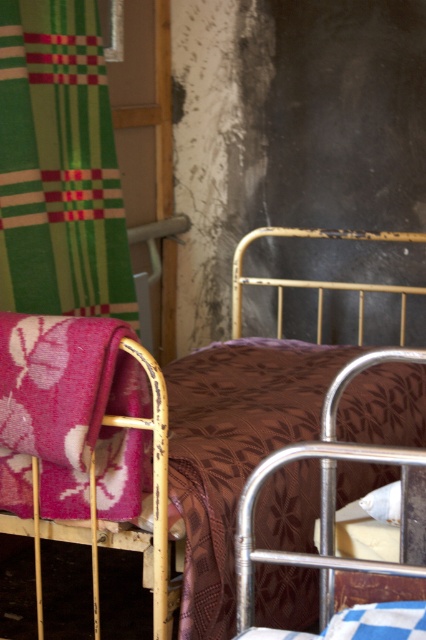
Does brown floral fabric at center lie behind brown floral fabric bed at center?

No.

Can you confirm if brown floral fabric at center is positioned below brown floral fabric bed at center?

Indeed, brown floral fabric at center is positioned under brown floral fabric bed at center.

What are the coordinates of `brown floral fabric at center` in the screenshot? It's located at (233, 451).

Is point (13, 58) less distant than point (146, 474)?

No, (13, 58) is behind (146, 474).

Does green striped fabric at upper left lie in front of floral pink fabric at left?

No.

Locate an element on the screen. green striped fabric at upper left is located at coordinates (58, 166).

Which is more to the right, brown floral fabric at center or green striped fabric at upper left?

From the viewer's perspective, brown floral fabric at center appears more on the right side.

Does point (235, 380) come closer to viewer compared to point (54, 19)?

No, it is not.

Locate an element on the screen. This screenshot has width=426, height=640. brown floral fabric at center is located at coordinates (233, 451).